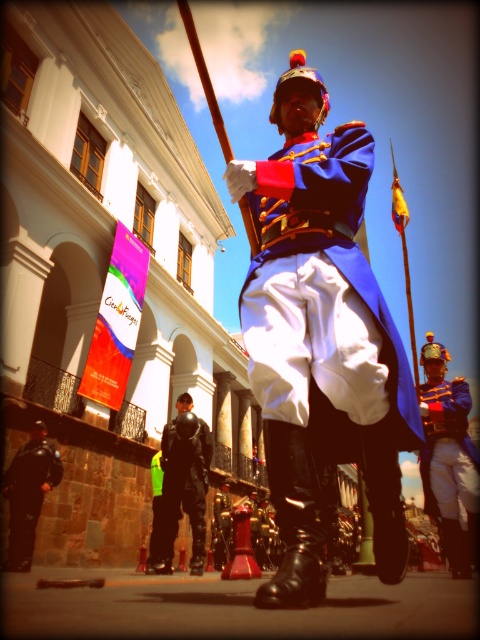
You are a costume designer preparing for a historical play. You need to ensure the blue glossy uniform at center and the black leather pants at lower left fit on a mannequin stand. Which object has a greater width?

The blue glossy uniform at center has a greater width than the black leather pants at lower left.

You are a photographer trying to capture a group photo of the matte blue uniform at center and the black leather jacket at lower center. You want to ensure both subjects are fully visible in the frame. Based on their sizes, which subject should you position closer to the camera to maintain their visibility?

Since the matte blue uniform at center is wider than the black leather jacket at lower center, positioning the matte blue uniform at center closer to the camera will help maintain visibility as it naturally occupies more space.